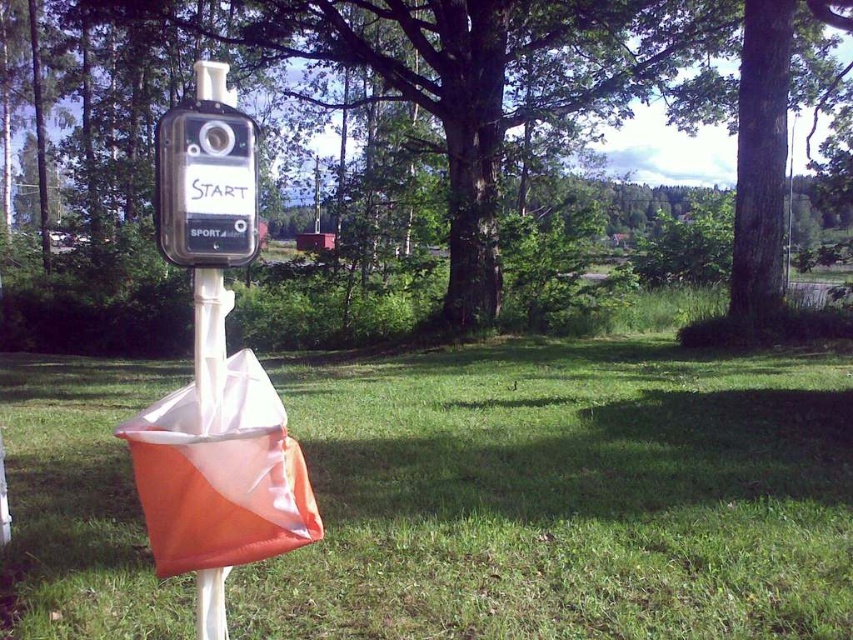
You are an orienteering participant standing at the starting marker. You need to quickly identify the landmarks. Which object at the center of the image has a greater width between the green grass at center and the green leafy tree at center?

The green grass at center has a greater width than the green leafy tree at center according to the description.

You are an orienteering participant standing at the starting point marker. You need to quickly determine which object at the center is shorter between the green grass at center and the green leafy tree at center. Which one is it?

The green grass at center is not as tall as the green leafy tree at center, so the green grass at center is shorter.